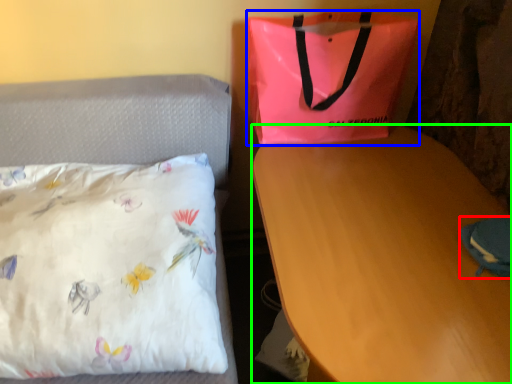
Question: Which object is positioned closest to pouch (highlighted by a red box)? Select from handbag (highlighted by a blue box) and desk (highlighted by a green box).

Choices:
 (A) handbag
 (B) desk

Answer: (B)